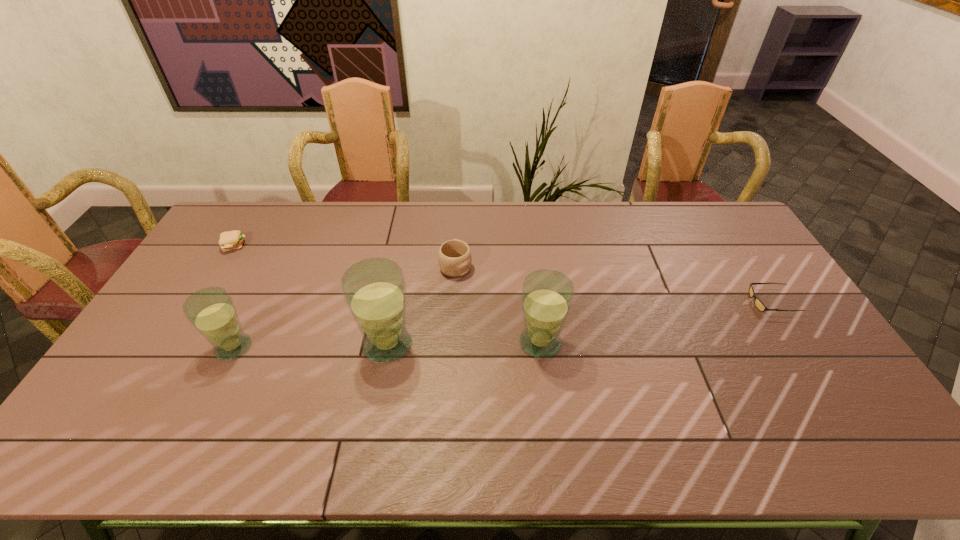
The image size is (960, 540). Find the location of `the shortest glass`. the shortest glass is located at coordinates tap(211, 310).

Locate an element on the screen. The width and height of the screenshot is (960, 540). the third tallest object is located at coordinates (211, 310).

This screenshot has height=540, width=960. Find the location of `the second glass from left to right`. the second glass from left to right is located at coordinates (374, 289).

This screenshot has height=540, width=960. In order to click on the fifth shortest object in this screenshot , I will do `click(547, 295)`.

Find the location of `the rightmost glass`. the rightmost glass is located at coordinates (547, 295).

Identify the location of the shortest object. (758, 303).

Locate an element on the screen. the fourth nearest object is located at coordinates (758, 303).

This screenshot has width=960, height=540. I want to click on the second shortest object, so point(232,240).

Identify the location of patty. The width and height of the screenshot is (960, 540). (232, 240).

This screenshot has height=540, width=960. What are the coordinates of `mug` in the screenshot? It's located at (454, 257).